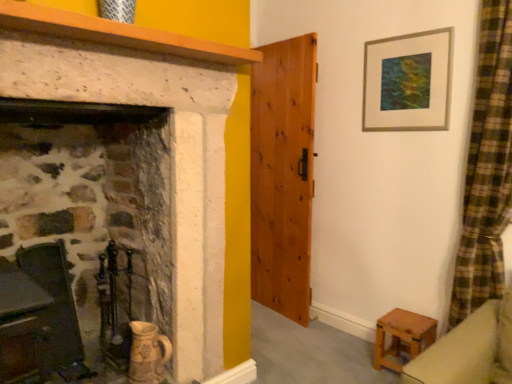
This screenshot has width=512, height=384. I want to click on free space to the left of wooden stool at lower right, so click(x=357, y=358).